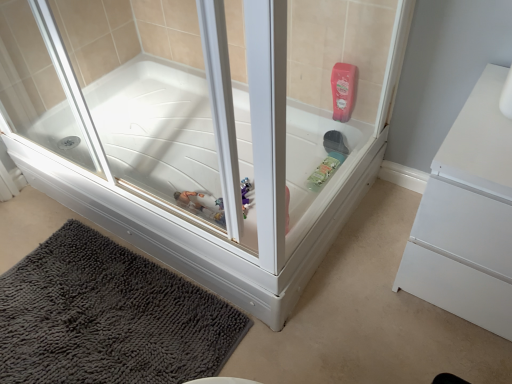
Question: Does white glossy bathtub at center lie in front of white matte dresser at right?

Choices:
 (A) no
 (B) yes

Answer: (B)

Question: Considering the relative sizes of white glossy bathtub at center and white matte dresser at right in the image provided, is white glossy bathtub at center smaller than white matte dresser at right?

Choices:
 (A) no
 (B) yes

Answer: (A)

Question: Does white glossy bathtub at center have a greater width compared to white matte dresser at right?

Choices:
 (A) yes
 (B) no

Answer: (B)

Question: Is white glossy bathtub at center outside of white matte dresser at right?

Choices:
 (A) yes
 (B) no

Answer: (A)

Question: Does white glossy bathtub at center have a lesser height compared to white matte dresser at right?

Choices:
 (A) yes
 (B) no

Answer: (B)

Question: From a real-world perspective, does white glossy bathtub at center sit lower than white matte dresser at right?

Choices:
 (A) yes
 (B) no

Answer: (B)

Question: Is dark gray shaggy bath mat at lower left at the back of white matte dresser at right?

Choices:
 (A) no
 (B) yes

Answer: (A)

Question: Is white matte dresser at right with dark gray shaggy bath mat at lower left?

Choices:
 (A) yes
 (B) no

Answer: (B)

Question: From the image's perspective, is white matte dresser at right under dark gray shaggy bath mat at lower left?

Choices:
 (A) no
 (B) yes

Answer: (A)

Question: Is white matte dresser at right outside dark gray shaggy bath mat at lower left?

Choices:
 (A) no
 (B) yes

Answer: (B)

Question: From a real-world perspective, is white matte dresser at right over dark gray shaggy bath mat at lower left?

Choices:
 (A) yes
 (B) no

Answer: (A)

Question: Considering the relative positions of white matte dresser at right and dark gray shaggy bath mat at lower left in the image provided, is white matte dresser at right to the right of dark gray shaggy bath mat at lower left from the viewer's perspective?

Choices:
 (A) yes
 (B) no

Answer: (A)

Question: From a real-world perspective, is dark gray shaggy bath mat at lower left on white matte dresser at right?

Choices:
 (A) yes
 (B) no

Answer: (B)